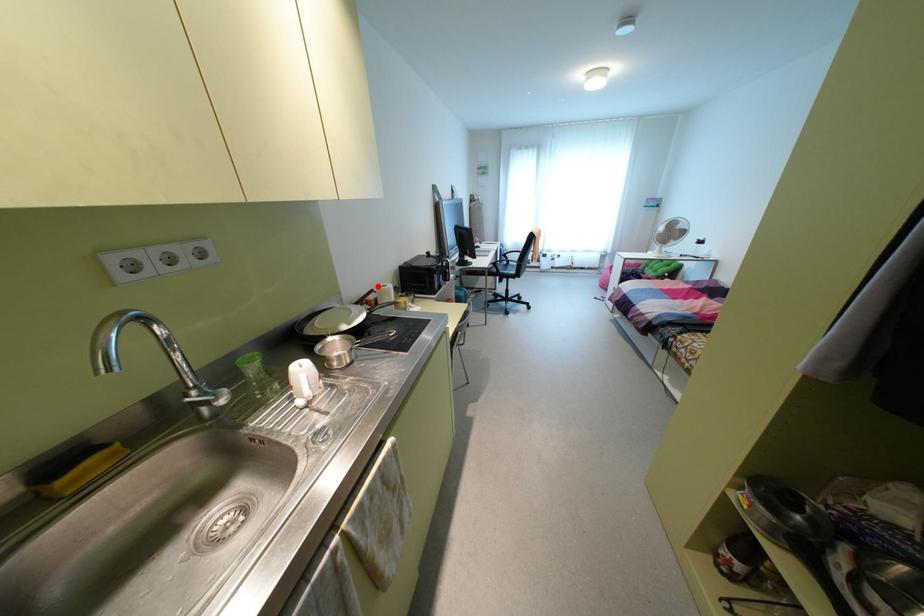
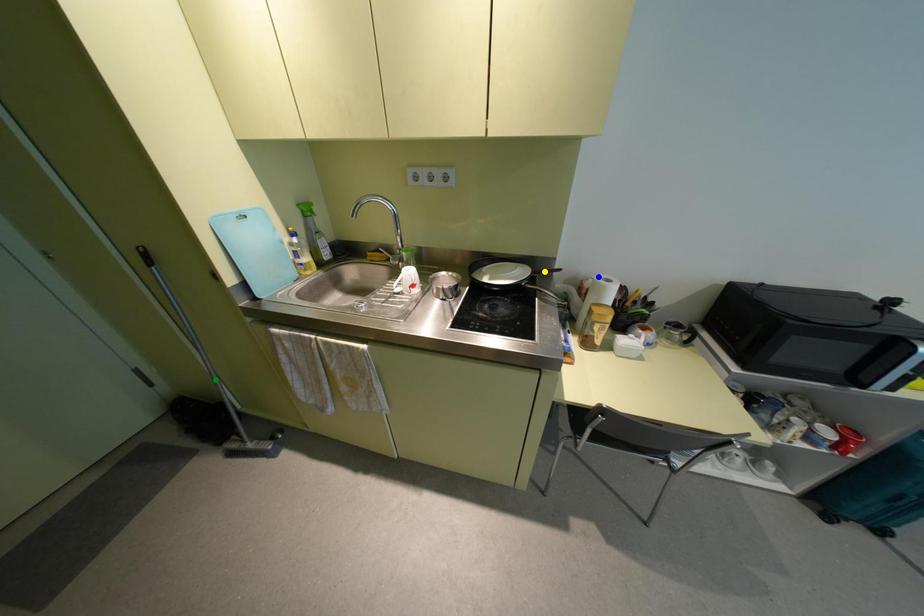
Question: I am providing you with two images of the same scene from different viewpoints. A red point is marked on the first image. You are given multiple points on the second image. Which point in image 2 is actually the same real-world point as the red point in image 1?

Choices:
 (A) blue point
 (B) green point
 (C) yellow point

Answer: (A)